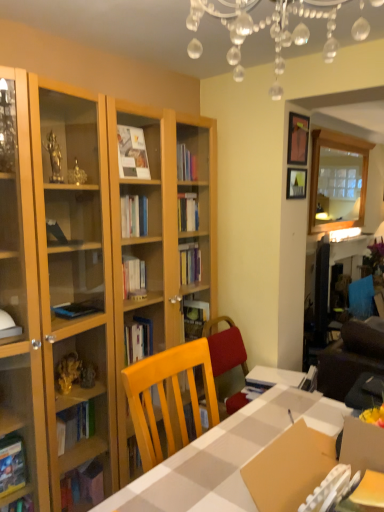
Question: Would you say matte black picture frame at upper right, which ranks as the second picture frame in bottom-to-top order, contains clear crystal chandelier at upper center?

Choices:
 (A) no
 (B) yes

Answer: (A)

Question: Considering the relative sizes of matte black picture frame at upper right, which ranks as the second picture frame in bottom-to-top order, and clear crystal chandelier at upper center in the image provided, is matte black picture frame at upper right, which ranks as the second picture frame in bottom-to-top order, thinner than clear crystal chandelier at upper center?

Choices:
 (A) yes
 (B) no

Answer: (A)

Question: Considering the relative sizes of matte black picture frame at upper right, marked as the first picture frame in a top-to-bottom arrangement, and clear crystal chandelier at upper center in the image provided, is matte black picture frame at upper right, marked as the first picture frame in a top-to-bottom arrangement, taller than clear crystal chandelier at upper center?

Choices:
 (A) yes
 (B) no

Answer: (B)

Question: Are matte black picture frame at upper right, which ranks as the second picture frame in bottom-to-top order, and clear crystal chandelier at upper center far apart?

Choices:
 (A) yes
 (B) no

Answer: (A)

Question: Is clear crystal chandelier at upper center at the back of matte black picture frame at upper right, which ranks as the second picture frame in bottom-to-top order?

Choices:
 (A) yes
 (B) no

Answer: (B)

Question: Considering the relative positions of matte black picture frame at upper right, marked as the first picture frame in a top-to-bottom arrangement, and clear crystal chandelier at upper center in the image provided, is matte black picture frame at upper right, marked as the first picture frame in a top-to-bottom arrangement, to the right of clear crystal chandelier at upper center from the viewer's perspective?

Choices:
 (A) no
 (B) yes

Answer: (B)

Question: From a real-world perspective, is matte black picture frame at upper right, marked as the first picture frame in a top-to-bottom arrangement, physically above white checkered table at center?

Choices:
 (A) yes
 (B) no

Answer: (A)

Question: Is matte black picture frame at upper right, marked as the first picture frame in a top-to-bottom arrangement, closer to the viewer compared to white checkered table at center?

Choices:
 (A) no
 (B) yes

Answer: (A)

Question: Could you tell me if matte black picture frame at upper right, which ranks as the second picture frame in bottom-to-top order, is turned towards white checkered table at center?

Choices:
 (A) no
 (B) yes

Answer: (A)

Question: Are matte black picture frame at upper right, marked as the first picture frame in a top-to-bottom arrangement, and white checkered table at center beside each other?

Choices:
 (A) yes
 (B) no

Answer: (B)

Question: Considering the relative sizes of matte black picture frame at upper right, which ranks as the second picture frame in bottom-to-top order, and white checkered table at center in the image provided, is matte black picture frame at upper right, which ranks as the second picture frame in bottom-to-top order, bigger than white checkered table at center?

Choices:
 (A) no
 (B) yes

Answer: (A)

Question: Considering the relative sizes of matte black picture frame at upper right, which ranks as the second picture frame in bottom-to-top order, and white checkered table at center in the image provided, is matte black picture frame at upper right, which ranks as the second picture frame in bottom-to-top order, wider than white checkered table at center?

Choices:
 (A) no
 (B) yes

Answer: (A)

Question: Is wooden picture frame at upper right, placed as the first picture frame when sorted from bottom to top, a part of clear glass mirror at upper right?

Choices:
 (A) yes
 (B) no

Answer: (B)